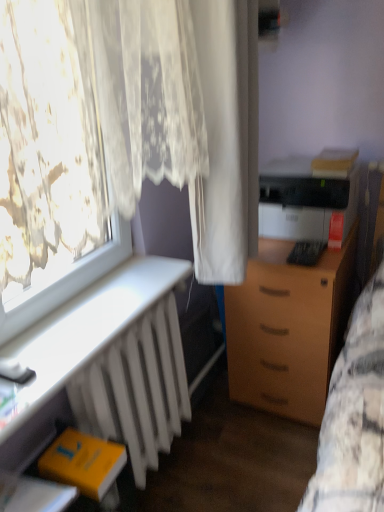
Identify the location of vacant space in front of wooden drawer at center-right. Image resolution: width=384 pixels, height=512 pixels. (261, 461).